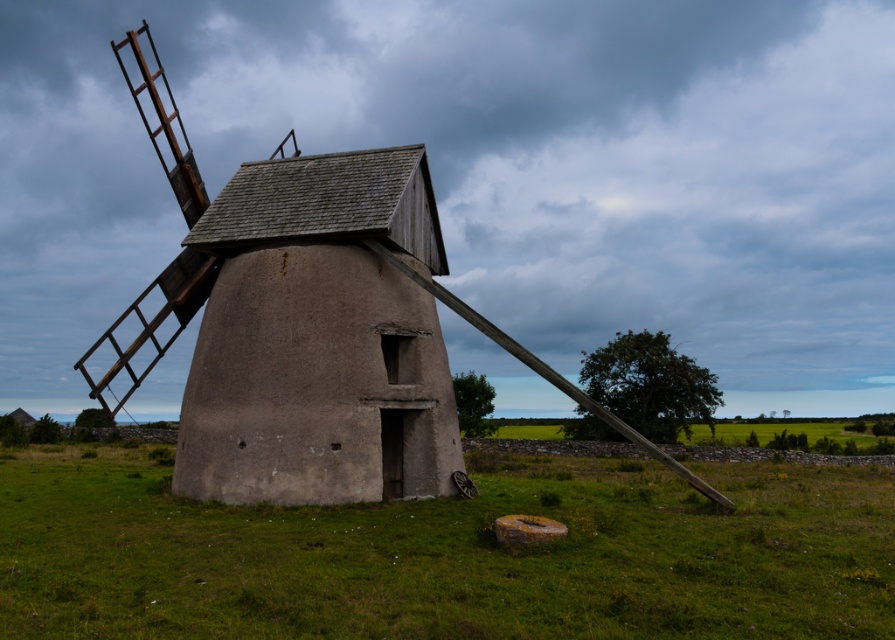
Who is shorter, rustic wood windmill at center or brown textured stone windmill at center?

brown textured stone windmill at center

Does rustic wood windmill at center appear on the right side of brown textured stone windmill at center?

Correct, you'll find rustic wood windmill at center to the right of brown textured stone windmill at center.

In the scene shown: Who is more distant from viewer, (250, 372) or (250, 225)?

The point (250, 225) is behind.

This screenshot has width=895, height=640. Find the location of `rustic wood windmill at center`. rustic wood windmill at center is located at coordinates click(307, 323).

How far apart are green grass at center and rustic wood windmill at center?

17.55 feet

Is point (531, 608) positioned after point (288, 182)?

That is False.

Where is `green grass at center`? The height and width of the screenshot is (640, 895). green grass at center is located at coordinates (446, 554).

Where is `green grass at center`? green grass at center is located at coordinates (446, 554).

Is the position of green grass at center less distant than that of brown textured stone windmill at center?

Yes, green grass at center is in front of brown textured stone windmill at center.

Can you confirm if green grass at center is positioned above brown textured stone windmill at center?

Actually, green grass at center is below brown textured stone windmill at center.

The image size is (895, 640). Identify the location of green grass at center. (446, 554).